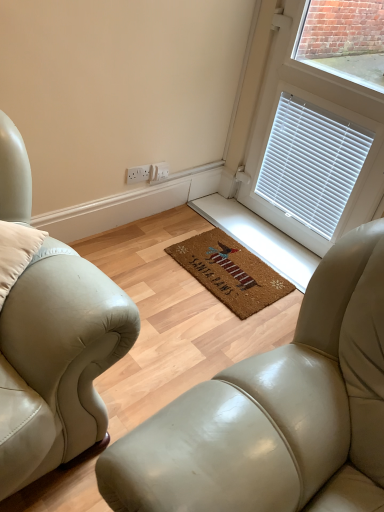
Question: Is white blinds at upper right not within white plastic electrical outlet at center?

Choices:
 (A) no
 (B) yes

Answer: (B)

Question: Is white blinds at upper right shorter than white plastic electrical outlet at center?

Choices:
 (A) yes
 (B) no

Answer: (B)

Question: From the image's perspective, does white blinds at upper right appear lower than white plastic electrical outlet at center?

Choices:
 (A) no
 (B) yes

Answer: (A)

Question: Can you confirm if white blinds at upper right is wider than white plastic electrical outlet at center?

Choices:
 (A) yes
 (B) no

Answer: (A)

Question: Is the depth of white blinds at upper right less than that of white plastic electrical outlet at center?

Choices:
 (A) yes
 (B) no

Answer: (A)

Question: Does white blinds at upper right have a greater height compared to white plastic electrical outlet at center?

Choices:
 (A) yes
 (B) no

Answer: (A)

Question: Does brown coir mat at center have a greater height compared to leather studio couch at center?

Choices:
 (A) no
 (B) yes

Answer: (A)

Question: Is brown coir mat at center closer to the viewer compared to leather studio couch at center?

Choices:
 (A) no
 (B) yes

Answer: (A)

Question: Is brown coir mat at center not inside leather studio couch at center?

Choices:
 (A) yes
 (B) no

Answer: (B)

Question: From a real-world perspective, does brown coir mat at center stand above leather studio couch at center?

Choices:
 (A) yes
 (B) no

Answer: (A)

Question: Can you confirm if brown coir mat at center is positioned to the left of leather studio couch at center?

Choices:
 (A) no
 (B) yes

Answer: (A)

Question: Is there a large distance between brown coir mat at center and leather studio couch at center?

Choices:
 (A) no
 (B) yes

Answer: (B)

Question: Considering the relative positions of leather studio couch at center and white blinds at upper right in the image provided, is leather studio couch at center to the left of white blinds at upper right from the viewer's perspective?

Choices:
 (A) no
 (B) yes

Answer: (B)